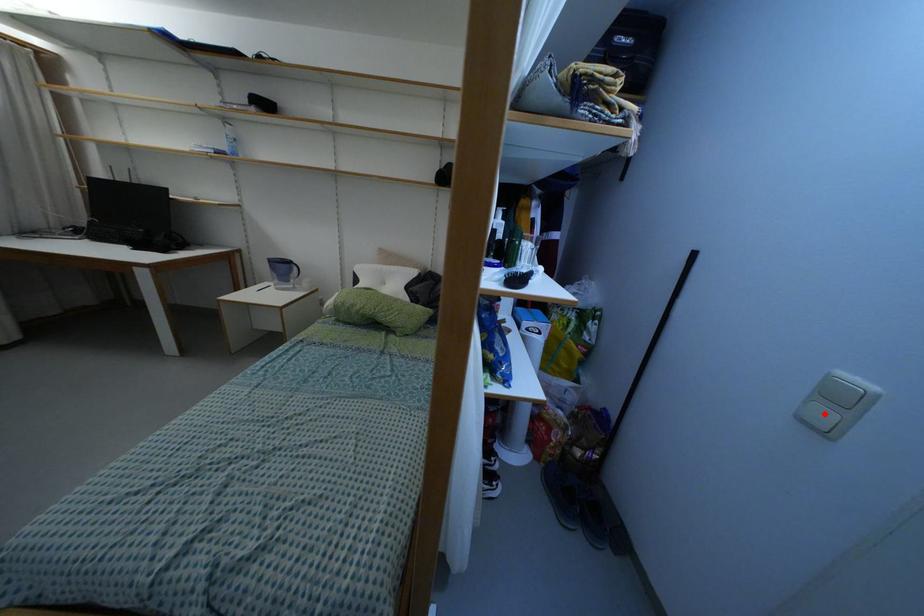
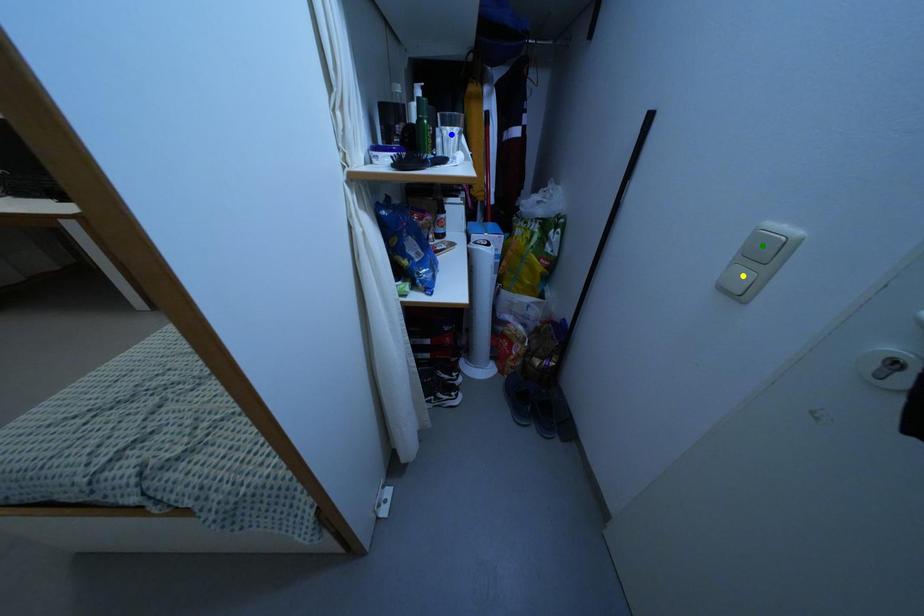
Question: I am providing you with two images of the same scene from different viewpoints. A red point is marked on the first image. You are given multiple points on the second image. Can you choose the point in image 2 that corresponds to the point in image 1?

Choices:
 (A) green point
 (B) blue point
 (C) yellow point

Answer: (C)